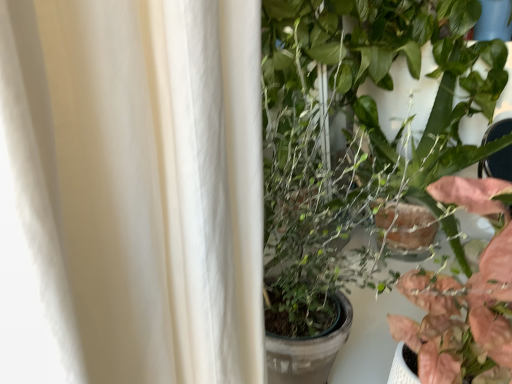
Question: Is green glossy plant at center, positioned as the 2th houseplant in bottom-to-top order, located within pink matte leafy plant at right, positioned as the 1th houseplant in bottom-to-top order?

Choices:
 (A) yes
 (B) no

Answer: (B)

Question: Is the depth of pink matte leafy plant at right, positioned as the second houseplant in top-to-bottom order, greater than that of green glossy plant at center, positioned as the 2th houseplant in bottom-to-top order?

Choices:
 (A) no
 (B) yes

Answer: (A)

Question: Is pink matte leafy plant at right, positioned as the second houseplant in top-to-bottom order, facing towards green glossy plant at center, positioned as the 2th houseplant in bottom-to-top order?

Choices:
 (A) yes
 (B) no

Answer: (B)

Question: Can you confirm if pink matte leafy plant at right, positioned as the second houseplant in top-to-bottom order, is positioned to the left of green glossy plant at center, arranged as the 1th houseplant when viewed from the top?

Choices:
 (A) no
 (B) yes

Answer: (B)

Question: Can you confirm if pink matte leafy plant at right, positioned as the 1th houseplant in bottom-to-top order, is shorter than green glossy plant at center, arranged as the 1th houseplant when viewed from the top?

Choices:
 (A) yes
 (B) no

Answer: (A)

Question: From a real-world perspective, is pink matte leafy plant at right, positioned as the second houseplant in top-to-bottom order, located higher than green glossy plant at center, positioned as the 2th houseplant in bottom-to-top order?

Choices:
 (A) no
 (B) yes

Answer: (A)

Question: Is green glossy plant at center, arranged as the 1th houseplant when viewed from the top, not within pink matte leafy plant at right, positioned as the second houseplant in top-to-bottom order?

Choices:
 (A) yes
 (B) no

Answer: (A)

Question: Considering the relative sizes of green glossy plant at center, positioned as the 2th houseplant in bottom-to-top order, and pink matte leafy plant at right, positioned as the second houseplant in top-to-bottom order, in the image provided, is green glossy plant at center, positioned as the 2th houseplant in bottom-to-top order, bigger than pink matte leafy plant at right, positioned as the second houseplant in top-to-bottom order,?

Choices:
 (A) no
 (B) yes

Answer: (B)

Question: From a real-world perspective, does green glossy plant at center, positioned as the 2th houseplant in bottom-to-top order, stand above pink matte leafy plant at right, positioned as the 1th houseplant in bottom-to-top order?

Choices:
 (A) yes
 (B) no

Answer: (A)

Question: Is the position of green glossy plant at center, arranged as the 1th houseplant when viewed from the top, less distant than that of pink matte leafy plant at right, positioned as the 1th houseplant in bottom-to-top order?

Choices:
 (A) no
 (B) yes

Answer: (A)

Question: Is green glossy plant at center, positioned as the 2th houseplant in bottom-to-top order, shorter than pink matte leafy plant at right, positioned as the second houseplant in top-to-bottom order?

Choices:
 (A) yes
 (B) no

Answer: (B)

Question: Is green glossy plant at center, arranged as the 1th houseplant when viewed from the top, oriented towards pink matte leafy plant at right, positioned as the second houseplant in top-to-bottom order?

Choices:
 (A) yes
 (B) no

Answer: (B)

Question: From the image's perspective, is green glossy plant at center, arranged as the 1th houseplant when viewed from the top, positioned above or below pink matte leafy plant at right, positioned as the 1th houseplant in bottom-to-top order?

Choices:
 (A) below
 (B) above

Answer: (B)